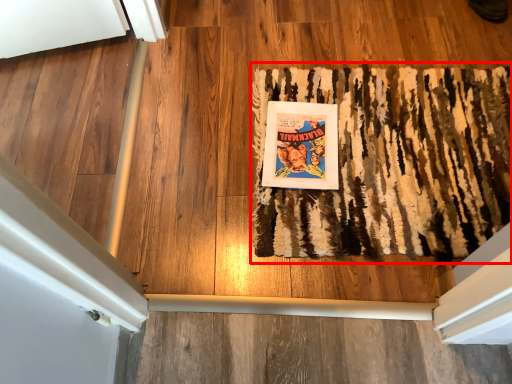
Question: From the image's perspective, what is the correct spatial relationship of mat (annotated by the red box) in relation to paperback book?

Choices:
 (A) above
 (B) below

Answer: (B)